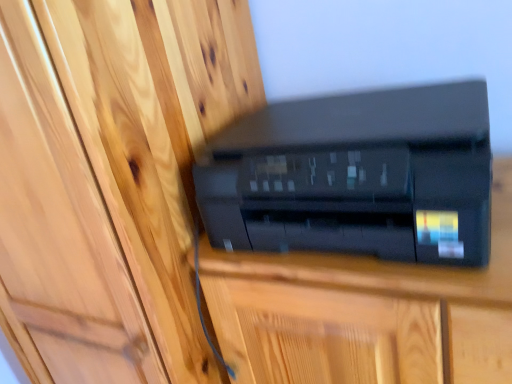
Question: From the image's perspective, is black plastic printer at center positioned above or below black plastic printer at center?

Choices:
 (A) above
 (B) below

Answer: (A)

Question: In the image, is black plastic printer at center positioned in front of or behind black plastic printer at center?

Choices:
 (A) front
 (B) behind

Answer: (A)

Question: Which is farther from the matte wood door at center?

Choices:
 (A) black plastic printer at center
 (B) black plastic printer at center

Answer: (A)

Question: Which of these objects is positioned closest to the black plastic printer at center?

Choices:
 (A) black plastic printer at center
 (B) matte wood door at center

Answer: (A)